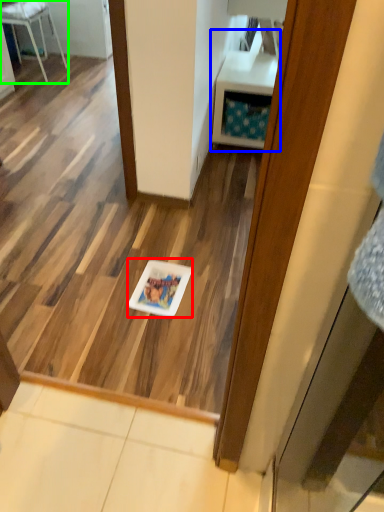
Question: Which object is the closest to the glass plate (highlighted by a red box)? Choose among these: vanity (highlighted by a blue box) or furniture (highlighted by a green box).

Choices:
 (A) vanity
 (B) furniture

Answer: (A)